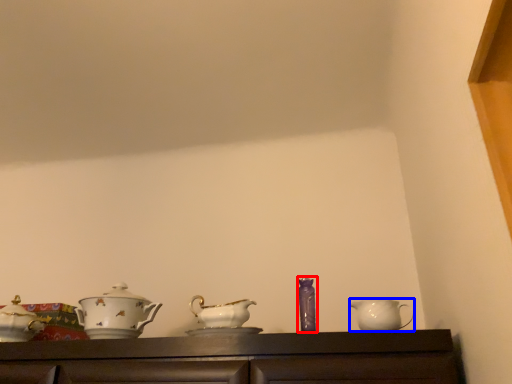
Question: Which object is further to the camera taking this photo, tableware (highlighted by a red box) or jug (highlighted by a blue box)?

Choices:
 (A) tableware
 (B) jug

Answer: (A)